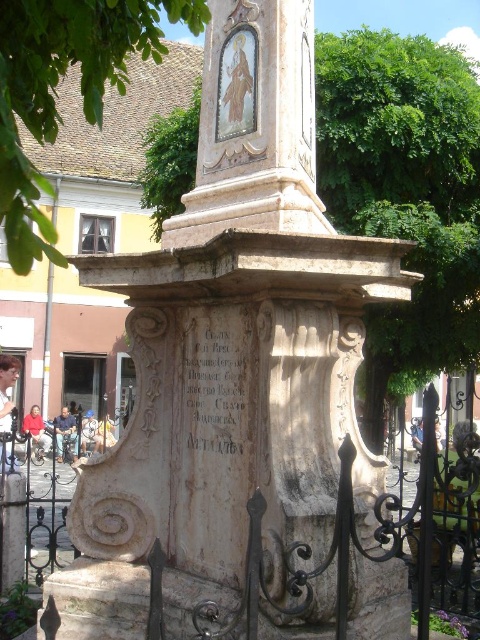
You are standing in the town square looking at the historical monument. You notice a point marked at coordinates (x=406, y=192). What object is located at that point?

→ The point at coordinates (x=406, y=192) indicates a green leafy tree at upper center.

You are a tourist standing in front of the monument. You notice a green leafy tree at upper center and a stone inscription at center. Which object appears bigger in the image?

The green leafy tree at upper center has a larger size compared to the stone inscription at center, so the green leafy tree at upper center appears bigger.